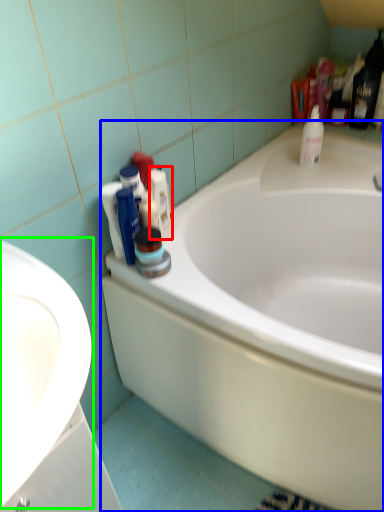
Question: Which is nearer to the toiletry (highlighted by a red box)? bathtub (highlighted by a blue box) or sink (highlighted by a green box).

Choices:
 (A) bathtub
 (B) sink

Answer: (A)